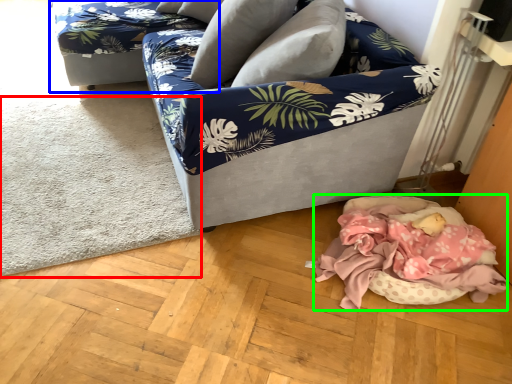
Question: Which object is positioned farthest from mat (highlighted by a red box)? Select from couch (highlighted by a blue box) and mattress (highlighted by a green box).

Choices:
 (A) couch
 (B) mattress

Answer: (B)